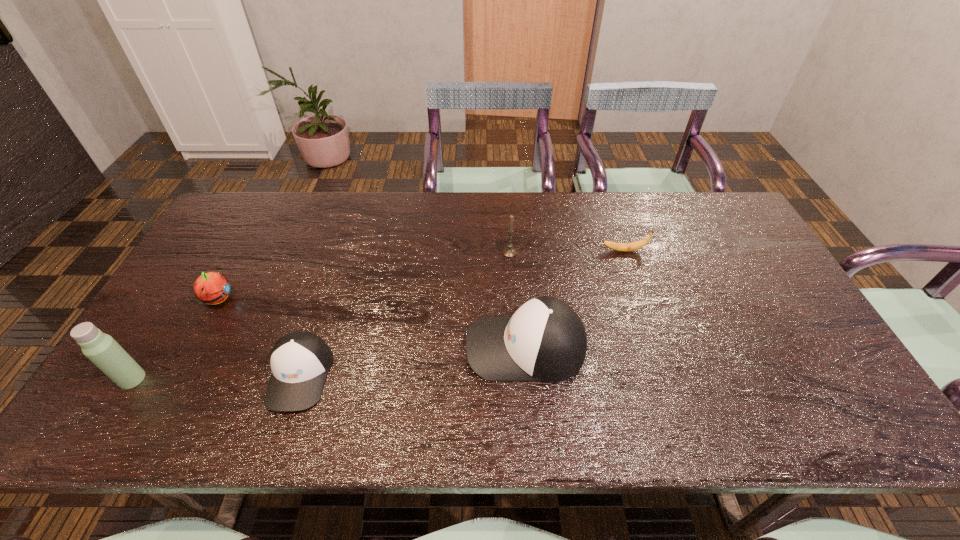
The height and width of the screenshot is (540, 960). In order to click on apple that is at the left edge in this screenshot , I will do `click(212, 288)`.

Find the location of a particular element. thermos bottle present at the left edge is located at coordinates (100, 348).

Image resolution: width=960 pixels, height=540 pixels. Identify the location of object positioned at the near left corner. (100, 348).

Locate an element on the screen. vacant space at the far edge of the desktop is located at coordinates (470, 231).

Find the location of a particular element. vacant space at the left edge is located at coordinates [x=195, y=321].

Where is `free location at the right edge of the desktop`? The width and height of the screenshot is (960, 540). free location at the right edge of the desktop is located at coordinates (768, 292).

Where is `vacant space at the far right corner of the desktop`? The width and height of the screenshot is (960, 540). vacant space at the far right corner of the desktop is located at coordinates (712, 236).

Locate an element on the screen. vacant space at the near right corner of the desktop is located at coordinates (780, 380).

Locate an element on the screen. This screenshot has width=960, height=540. vacant area between the candle and the left cap is located at coordinates (404, 314).

Find the location of a particular element. free area in between the leftmost object and the third object from left to right is located at coordinates (216, 377).